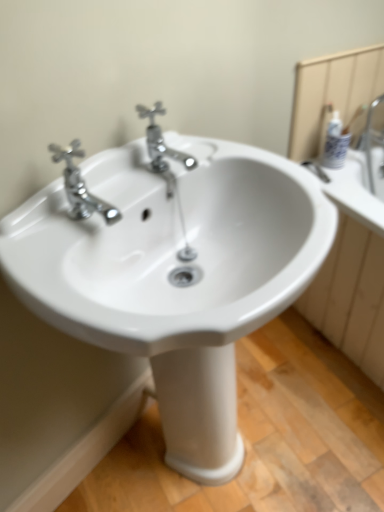
Question: From the image's perspective, is white glossy sink at center positioned above or below chrome metallic faucet at upper left, the first tap from the left?

Choices:
 (A) above
 (B) below

Answer: (B)

Question: Is white glossy sink at center wider or thinner than chrome metallic faucet at upper left, the 2th tap when ordered from right to left?

Choices:
 (A) thin
 (B) wide

Answer: (B)

Question: Estimate the real-world distances between objects in this image. Which object is farther from the white glossy mirror at upper right?

Choices:
 (A) white glossy sink at center
 (B) chrome/metallic faucet at center, positioned as the 1th tap in right-to-left order
 (C) chrome metallic faucet at upper left, the 2th tap when ordered from right to left

Answer: (C)

Question: Estimate the real-world distances between objects in this image. Which object is closer to the chrome/metallic faucet at center, positioned as the 1th tap in right-to-left order?

Choices:
 (A) chrome metallic faucet at upper left, the 2th tap when ordered from right to left
 (B) white glossy mirror at upper right
 (C) white glossy sink at center

Answer: (A)